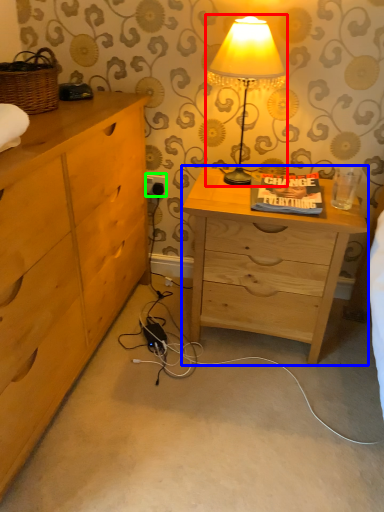
Question: Considering the real-world distances, which object is closest to lamp (highlighted by a red box)? nightstand (highlighted by a blue box) or electric outlet (highlighted by a green box).

Choices:
 (A) nightstand
 (B) electric outlet

Answer: (A)